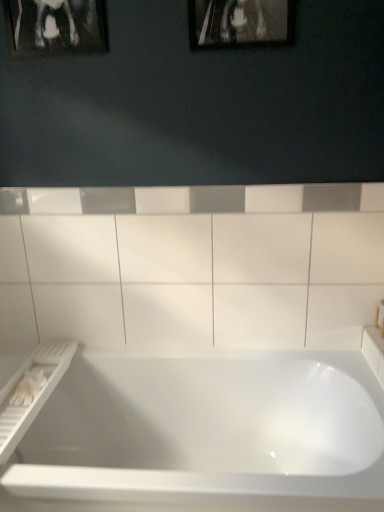
Question: Does metallic silver picture frame at upper center, the 1th picture frame from the right, come behind white glossy ceramic tile at center?

Choices:
 (A) yes
 (B) no

Answer: (B)

Question: Would you say metallic silver picture frame at upper center, the 1th picture frame from the right, is outside white glossy ceramic tile at center?

Choices:
 (A) yes
 (B) no

Answer: (A)

Question: Are metallic silver picture frame at upper center, the 1th picture frame from the right, and white glossy ceramic tile at center located far from each other?

Choices:
 (A) no
 (B) yes

Answer: (A)

Question: From the image's perspective, is metallic silver picture frame at upper center, the 2th picture frame in the left-to-right sequence, on white glossy ceramic tile at center?

Choices:
 (A) no
 (B) yes

Answer: (B)

Question: Can white glossy ceramic tile at center be found inside metallic silver picture frame at upper center, the 1th picture frame from the right?

Choices:
 (A) no
 (B) yes

Answer: (A)

Question: Can you confirm if metallic silver picture frame at upper center, the 1th picture frame from the right, is positioned to the left of white glossy ceramic tile at center?

Choices:
 (A) yes
 (B) no

Answer: (B)

Question: From a real-world perspective, is metallic silver picture frame at upper center, the 2th picture frame in the left-to-right sequence, physically below black glossy picture frame at upper left, the first picture frame positioned from the left?

Choices:
 (A) no
 (B) yes

Answer: (B)

Question: Is metallic silver picture frame at upper center, the 1th picture frame from the right, outside of black glossy picture frame at upper left, acting as the second picture frame starting from the right?

Choices:
 (A) yes
 (B) no

Answer: (A)

Question: Is metallic silver picture frame at upper center, the 2th picture frame in the left-to-right sequence, shorter than black glossy picture frame at upper left, the first picture frame positioned from the left?

Choices:
 (A) yes
 (B) no

Answer: (B)

Question: From the image's perspective, is metallic silver picture frame at upper center, the 1th picture frame from the right, above black glossy picture frame at upper left, the first picture frame positioned from the left?

Choices:
 (A) yes
 (B) no

Answer: (B)

Question: Is metallic silver picture frame at upper center, the 1th picture frame from the right, far from black glossy picture frame at upper left, the first picture frame positioned from the left?

Choices:
 (A) no
 (B) yes

Answer: (A)

Question: Considering the relative sizes of metallic silver picture frame at upper center, the 2th picture frame in the left-to-right sequence, and black glossy picture frame at upper left, acting as the second picture frame starting from the right, in the image provided, is metallic silver picture frame at upper center, the 2th picture frame in the left-to-right sequence, smaller than black glossy picture frame at upper left, acting as the second picture frame starting from the right,?

Choices:
 (A) no
 (B) yes

Answer: (A)

Question: Considering the relative sizes of black glossy picture frame at upper left, the first picture frame positioned from the left, and white glossy ceramic tile at center in the image provided, is black glossy picture frame at upper left, the first picture frame positioned from the left, taller than white glossy ceramic tile at center?

Choices:
 (A) yes
 (B) no

Answer: (B)